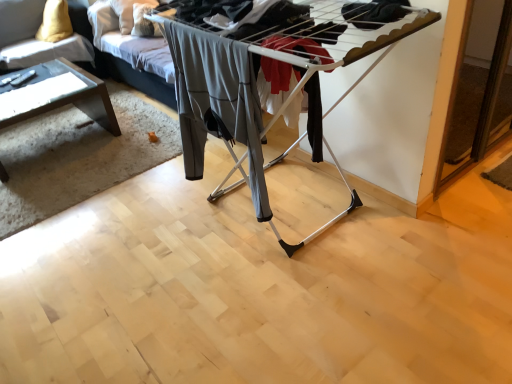
Question: Is velvet yellow pillow at upper left aimed at clear glass table at left?

Choices:
 (A) no
 (B) yes

Answer: (A)

Question: Does velvet yellow pillow at upper left lie in front of clear glass table at left?

Choices:
 (A) no
 (B) yes

Answer: (A)

Question: Is velvet yellow pillow at upper left not near clear glass table at left?

Choices:
 (A) no
 (B) yes

Answer: (A)

Question: Is velvet yellow pillow at upper left not inside clear glass table at left?

Choices:
 (A) yes
 (B) no

Answer: (A)

Question: From a real-world perspective, does velvet yellow pillow at upper left sit lower than clear glass table at left?

Choices:
 (A) yes
 (B) no

Answer: (B)

Question: Does point (96, 97) appear closer or farther from the camera than point (193, 99)?

Choices:
 (A) closer
 (B) farther

Answer: (B)

Question: Is clear glass table at left situated inside gray fabric pants at center or outside?

Choices:
 (A) inside
 (B) outside

Answer: (B)

Question: From a real-world perspective, is clear glass table at left above or below gray fabric pants at center?

Choices:
 (A) below
 (B) above

Answer: (A)

Question: Considering their positions, is clear glass table at left located in front of or behind gray fabric pants at center?

Choices:
 (A) behind
 (B) front

Answer: (A)

Question: Is clear glass table at left wider or thinner than velvet yellow pillow at upper left?

Choices:
 (A) wide
 (B) thin

Answer: (A)

Question: Is point (51, 86) positioned closer to the camera than point (35, 29)?

Choices:
 (A) closer
 (B) farther

Answer: (A)

Question: In the image, is clear glass table at left positioned in front of or behind velvet yellow pillow at upper left?

Choices:
 (A) behind
 (B) front

Answer: (B)

Question: Which is correct: clear glass table at left is inside velvet yellow pillow at upper left, or outside of it?

Choices:
 (A) outside
 (B) inside

Answer: (A)

Question: From the image's perspective, relative to clear glass table at left, is velvet yellow pillow at upper left above or below?

Choices:
 (A) below
 (B) above

Answer: (B)

Question: Considering the positions of velvet yellow pillow at upper left and clear glass table at left in the image, is velvet yellow pillow at upper left taller or shorter than clear glass table at left?

Choices:
 (A) short
 (B) tall

Answer: (B)